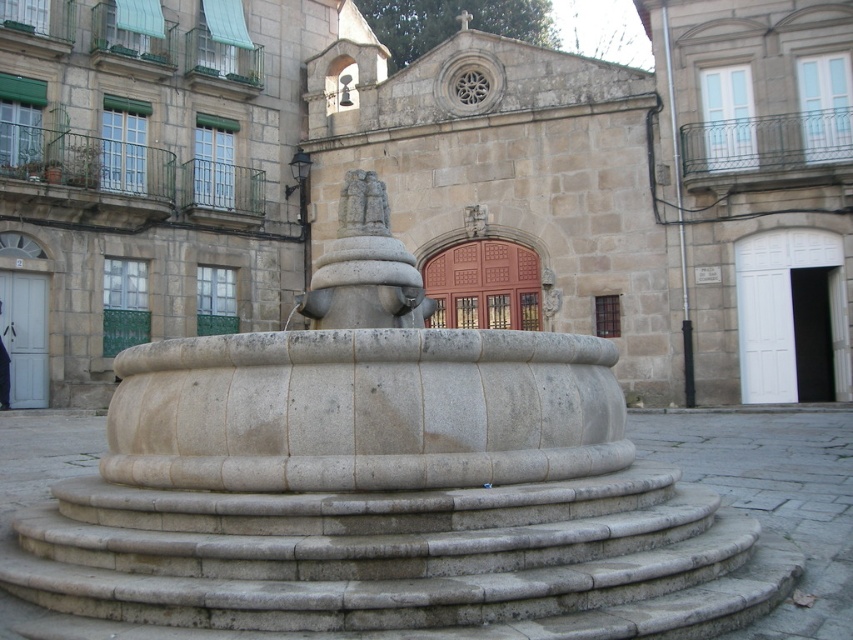
Who is positioned more to the right, smooth stone fountain at center or smooth stone stairs at center?

From the viewer's perspective, smooth stone fountain at center appears more on the right side.

Which of these two, smooth stone fountain at center or smooth stone stairs at center, stands shorter?

Standing shorter between the two is smooth stone fountain at center.

At what (x,y) coordinates should I click in order to perform the action: click on smooth stone fountain at center. Please return your answer as a coordinate pair (x, y). Looking at the image, I should click on (381, 490).

In order to click on smooth stone fountain at center in this screenshot , I will do `click(381, 490)`.

Is point (735, 563) closer to camera compared to point (386, 224)?

Yes, point (735, 563) is closer to viewer.

Is smooth stone stairs at center closer to camera compared to gray stone statue at center?

Yes.

Looking at this image, who is more forward, (334, 508) or (340, 204)?

Point (334, 508) is more forward.

Identify the location of smooth stone stairs at center. The height and width of the screenshot is (640, 853). (392, 550).

Is point (80, 566) positioned behind point (376, 179)?

No.

Does smooth stone fountain at center appear under gray stone statue at center?

Yes, smooth stone fountain at center is below gray stone statue at center.

Does point (350, 556) come farther from viewer compared to point (352, 234)?

No, it is not.

The image size is (853, 640). In order to click on smooth stone fountain at center in this screenshot , I will do `click(381, 490)`.